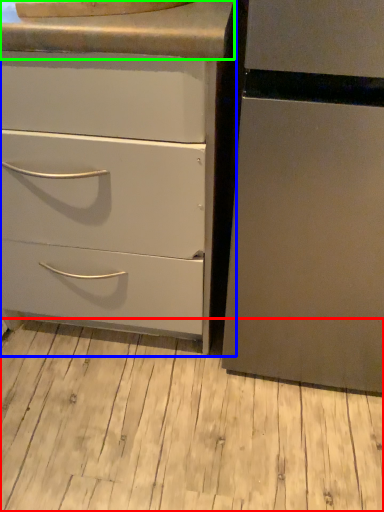
Question: Considering the real-world distances, which object is farthest from plank (highlighted by a red box)? chest of drawers (highlighted by a blue box) or counter top (highlighted by a green box)?

Choices:
 (A) chest of drawers
 (B) counter top

Answer: (B)